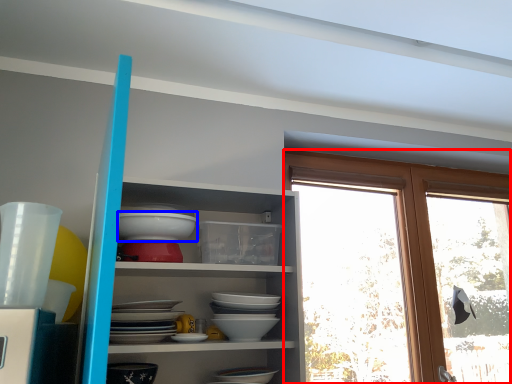
Question: Among these objects, which one is nearest to the camera, window (highlighted by a red box) or bowl (highlighted by a blue box)?

Choices:
 (A) window
 (B) bowl

Answer: (B)